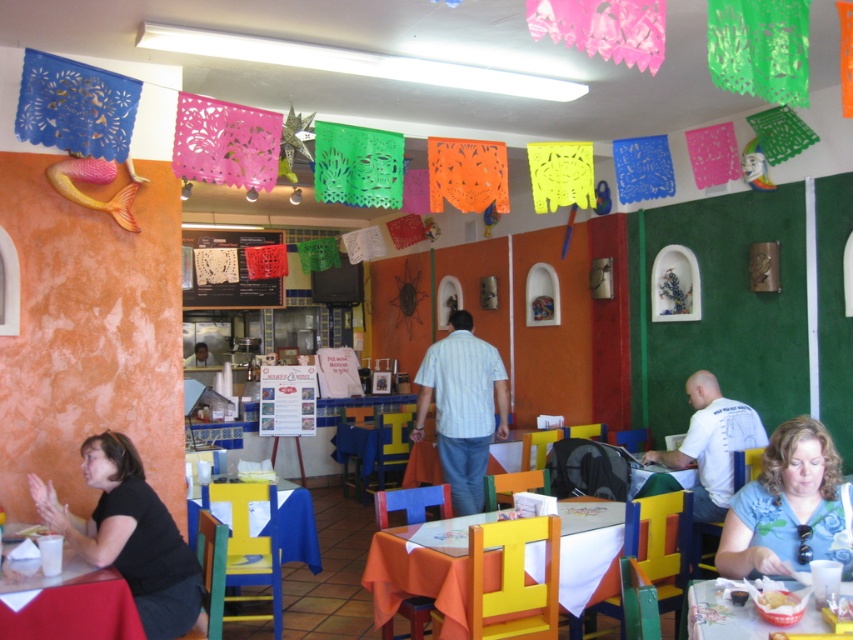
Is black fabric shirt at lower left further to the viewer compared to smooth plastic table at lower left?

Yes, black fabric shirt at lower left is further from the viewer.

Does black fabric shirt at lower left have a lesser height compared to smooth plastic table at lower left?

No, black fabric shirt at lower left is not shorter than smooth plastic table at lower left.

Where is `black fabric shirt at lower left`? Image resolution: width=853 pixels, height=640 pixels. black fabric shirt at lower left is located at coordinates (131, 536).

The height and width of the screenshot is (640, 853). What are the coordinates of `black fabric shirt at lower left` in the screenshot? It's located at (131, 536).

Who is lower down, black fabric shirt at lower left or white lace menu at center?

black fabric shirt at lower left is below.

Who is more forward, (105, 474) or (251, 230)?

Positioned in front is point (105, 474).

Find the location of `black fabric shirt at lower left`. black fabric shirt at lower left is located at coordinates (131, 536).

Which is below, black fabric shirt at lower left or matte plastic bowl at lower right?

black fabric shirt at lower left is below.

How much distance is there between black fabric shirt at lower left and matte plastic bowl at lower right?

1.97 meters

Identify the location of black fabric shirt at lower left. (131, 536).